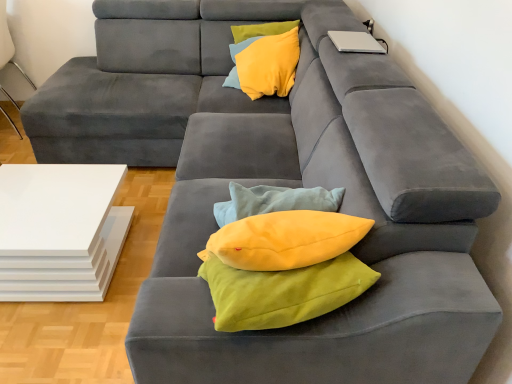
Question: Is yellow soft cushion at upper center smaller than white glossy table at lower left?

Choices:
 (A) yes
 (B) no

Answer: (A)

Question: Is the depth of yellow soft cushion at upper center greater than that of white glossy table at lower left?

Choices:
 (A) yes
 (B) no

Answer: (A)

Question: Considering the relative sizes of yellow soft cushion at upper center and white glossy table at lower left in the image provided, is yellow soft cushion at upper center thinner than white glossy table at lower left?

Choices:
 (A) yes
 (B) no

Answer: (A)

Question: Can you confirm if yellow soft cushion at upper center is shorter than white glossy table at lower left?

Choices:
 (A) no
 (B) yes

Answer: (B)

Question: Does yellow soft cushion at upper center touch white glossy table at lower left?

Choices:
 (A) yes
 (B) no

Answer: (B)

Question: From a real-world perspective, is yellow soft cushion at upper center on top of white glossy table at lower left?

Choices:
 (A) yes
 (B) no

Answer: (A)

Question: Can you confirm if yellow soft cushion at upper center is positioned to the right of silver metallic laptop at upper right?

Choices:
 (A) yes
 (B) no

Answer: (B)

Question: Considering the relative positions of yellow soft cushion at upper center and silver metallic laptop at upper right in the image provided, is yellow soft cushion at upper center to the left of silver metallic laptop at upper right from the viewer's perspective?

Choices:
 (A) yes
 (B) no

Answer: (A)

Question: From the image's perspective, is yellow soft cushion at upper center located above silver metallic laptop at upper right?

Choices:
 (A) no
 (B) yes

Answer: (B)

Question: Would you say yellow soft cushion at upper center is outside silver metallic laptop at upper right?

Choices:
 (A) yes
 (B) no

Answer: (A)

Question: Can you confirm if yellow soft cushion at upper center is bigger than silver metallic laptop at upper right?

Choices:
 (A) yes
 (B) no

Answer: (A)

Question: Does yellow soft cushion at upper center have a greater height compared to silver metallic laptop at upper right?

Choices:
 (A) no
 (B) yes

Answer: (B)

Question: Is white glossy table at lower left shorter than silver metallic laptop at upper right?

Choices:
 (A) yes
 (B) no

Answer: (B)